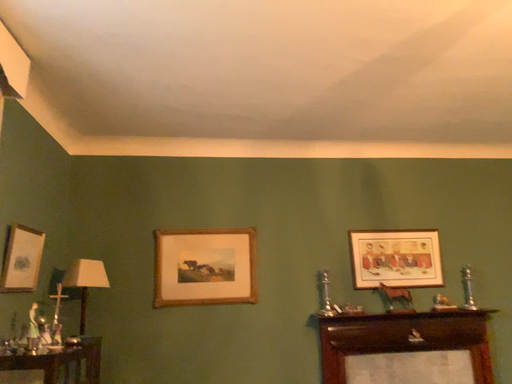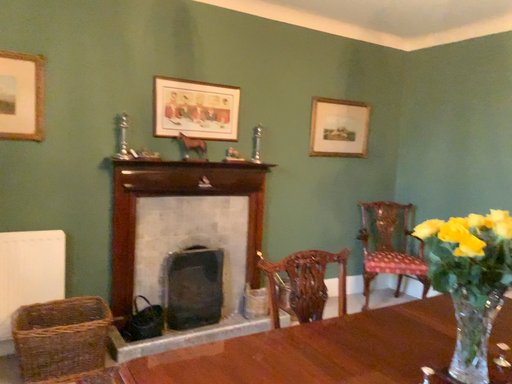
Question: Which way did the camera rotate in the video?

Choices:
 (A) rotated right
 (B) rotated left

Answer: (A)